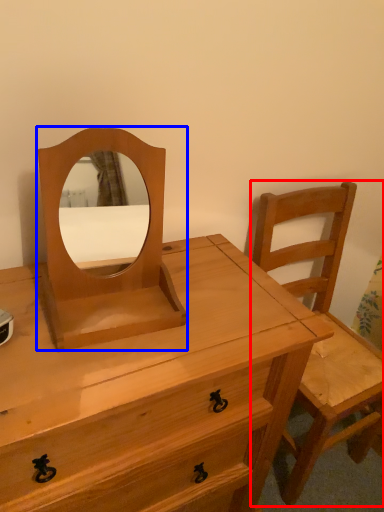
Question: Which of the following is the farthest to the observer, chair (highlighted by a red box) or mirror (highlighted by a blue box)?

Choices:
 (A) chair
 (B) mirror

Answer: (A)